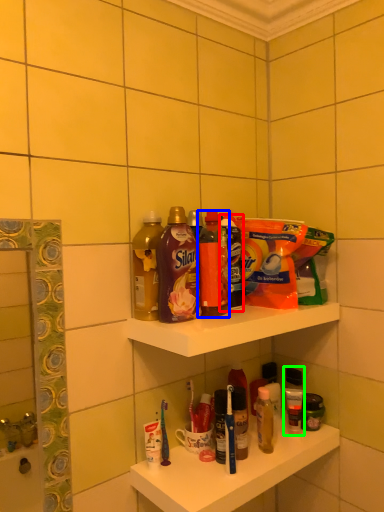
Question: Estimate the real-world distances between objects in this image. Which object is farther from cleaning product (highlighted by a red box), bottle (highlighted by a blue box) or toiletry (highlighted by a green box)?

Choices:
 (A) bottle
 (B) toiletry

Answer: (B)